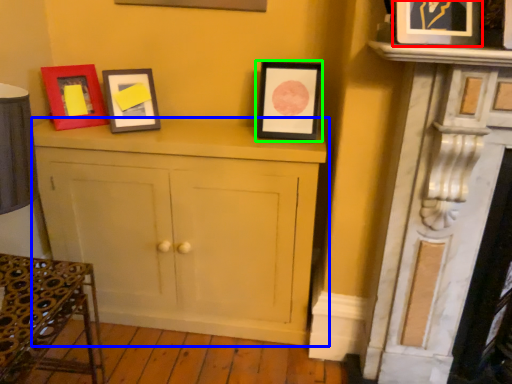
Question: Estimate the real-world distances between objects in this image. Which object is farther from picture frame (highlighted by a red box), cabinetry (highlighted by a blue box) or picture frame (highlighted by a green box)?

Choices:
 (A) cabinetry
 (B) picture frame

Answer: (A)